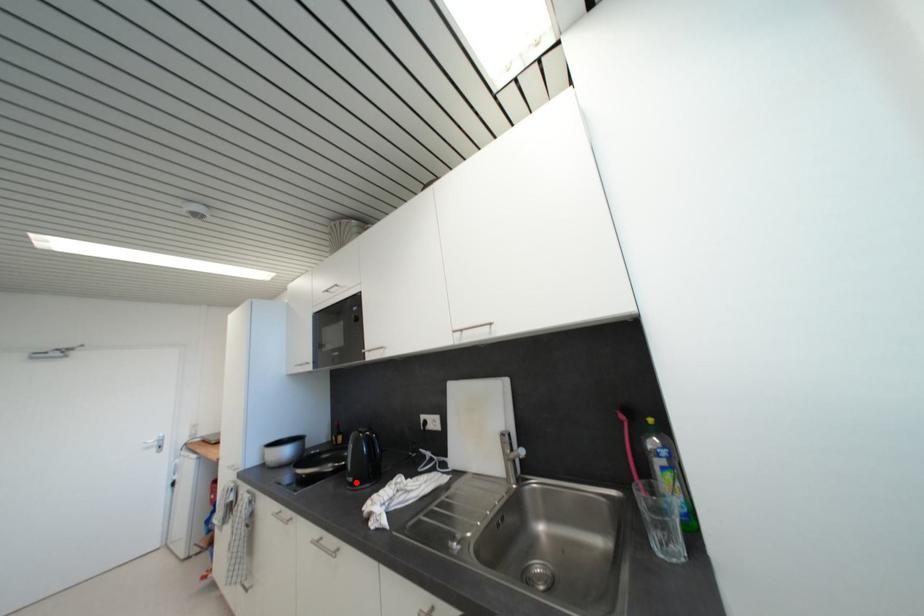
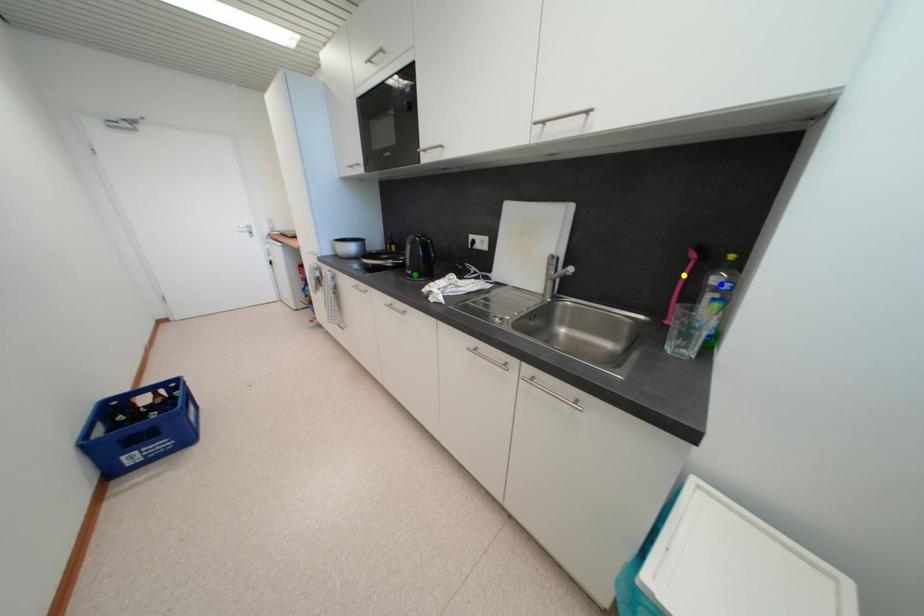
Question: I am providing you with two images of the same scene from different viewpoints. A red point is marked on the first image. You are given multiple points on the second image. Which point in image 2 represents the same 3d spot as the red point in image 1?

Choices:
 (A) blue point
 (B) yellow point
 (C) green point

Answer: (C)